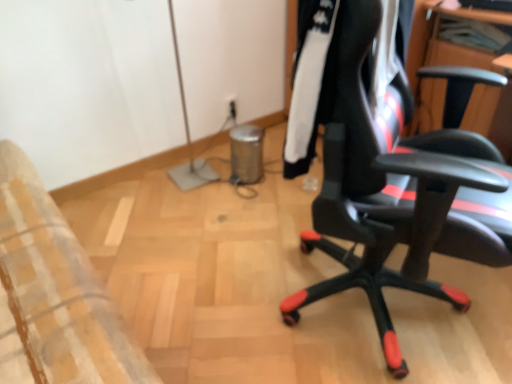
Question: In terms of height, does black leather office chair at right look taller or shorter compared to black synthetic jacket at center right?

Choices:
 (A) short
 (B) tall

Answer: (B)

Question: From a real-world perspective, is black leather office chair at right above or below black synthetic jacket at center right?

Choices:
 (A) below
 (B) above

Answer: (A)

Question: Is point (349, 230) positioned closer to the camera than point (307, 122)?

Choices:
 (A) farther
 (B) closer

Answer: (A)

Question: From their relative heights in the image, would you say black synthetic jacket at center right is taller or shorter than black leather office chair at right?

Choices:
 (A) tall
 (B) short

Answer: (B)

Question: Is black synthetic jacket at center right bigger or smaller than black leather office chair at right?

Choices:
 (A) big
 (B) small

Answer: (B)

Question: Considering the positions of point (395, 71) and point (373, 258), is point (395, 71) closer or farther from the camera than point (373, 258)?

Choices:
 (A) farther
 (B) closer

Answer: (B)

Question: Is black synthetic jacket at center right spatially inside black leather office chair at right, or outside of it?

Choices:
 (A) inside
 (B) outside

Answer: (A)